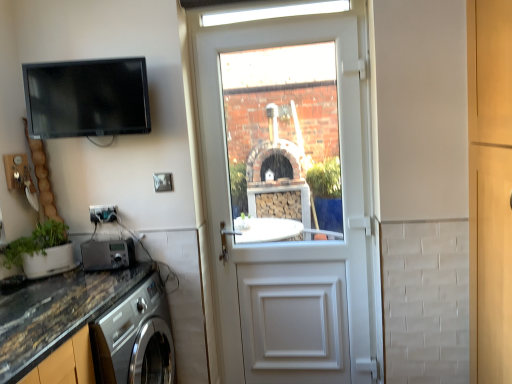
Question: From the image's perspective, is green matte plant at lower left under metallic silver radio at lower left, marked as the second appliance in a top-to-bottom arrangement?

Choices:
 (A) no
 (B) yes

Answer: (A)

Question: Does green matte plant at lower left have a lesser width compared to metallic silver radio at lower left, placed as the 1th appliance when sorted from bottom to top?

Choices:
 (A) yes
 (B) no

Answer: (B)

Question: Is green matte plant at lower left next to metallic silver radio at lower left, placed as the 1th appliance when sorted from bottom to top, and touching it?

Choices:
 (A) no
 (B) yes

Answer: (A)

Question: Is green matte plant at lower left at the right side of metallic silver radio at lower left, placed as the 1th appliance when sorted from bottom to top?

Choices:
 (A) no
 (B) yes

Answer: (A)

Question: Does green matte plant at lower left come in front of metallic silver radio at lower left, placed as the 1th appliance when sorted from bottom to top?

Choices:
 (A) yes
 (B) no

Answer: (A)

Question: Relative to green matte plant at lower left, is metallic silver radio at lower left, placed as the 1th appliance when sorted from bottom to top, in front or behind?

Choices:
 (A) front
 (B) behind

Answer: (B)

Question: Is metallic silver radio at lower left, marked as the second appliance in a top-to-bottom arrangement, to the left or to the right of green matte plant at lower left in the image?

Choices:
 (A) right
 (B) left

Answer: (A)

Question: Is point (117, 263) closer or farther from the camera than point (28, 274)?

Choices:
 (A) farther
 (B) closer

Answer: (A)

Question: Considering the positions of metallic silver radio at lower left, placed as the 1th appliance when sorted from bottom to top, and green matte plant at lower left in the image, is metallic silver radio at lower left, placed as the 1th appliance when sorted from bottom to top, wider or thinner than green matte plant at lower left?

Choices:
 (A) wide
 (B) thin

Answer: (B)

Question: Looking at their shapes, would you say white plastic door at center is wider or thinner than matte black tv at upper left, the 2th appliance positioned from the bottom?

Choices:
 (A) wide
 (B) thin

Answer: (B)

Question: From a real-world perspective, relative to matte black tv at upper left, the 2th appliance positioned from the bottom, is white plastic door at center vertically above or below?

Choices:
 (A) below
 (B) above

Answer: (A)

Question: Choose the correct answer: Is white plastic door at center inside matte black tv at upper left, the 2th appliance positioned from the bottom, or outside it?

Choices:
 (A) inside
 (B) outside

Answer: (B)

Question: Is point (253, 79) closer or farther from the camera than point (35, 97)?

Choices:
 (A) closer
 (B) farther

Answer: (B)

Question: Relative to metallic silver radio at lower left, placed as the 1th appliance when sorted from bottom to top, is white plastic door at center in front or behind?

Choices:
 (A) front
 (B) behind

Answer: (B)

Question: Is white plastic door at center taller or shorter than metallic silver radio at lower left, marked as the second appliance in a top-to-bottom arrangement?

Choices:
 (A) short
 (B) tall

Answer: (B)